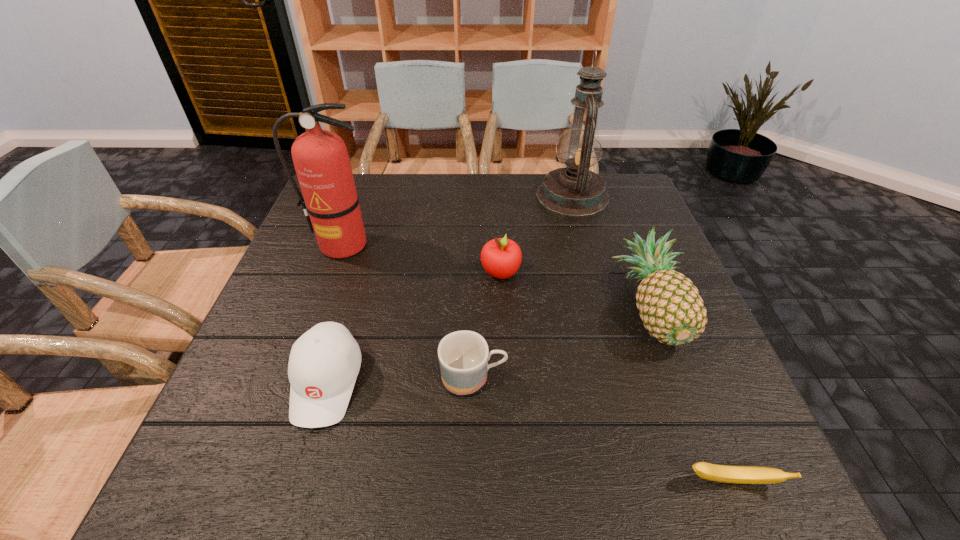
Where is `vacant space positioned 0.240m on the front of the third tallest object`? vacant space positioned 0.240m on the front of the third tallest object is located at coordinates (719, 483).

Image resolution: width=960 pixels, height=540 pixels. Identify the location of vacant position located on the right of the apple. (598, 273).

The image size is (960, 540). I want to click on free spot located 0.090m on the front-facing side of the baseball cap, so pos(297,483).

The height and width of the screenshot is (540, 960). I want to click on free space located on the side with the handle of the mug, so click(x=599, y=378).

The width and height of the screenshot is (960, 540). I want to click on object that is positioned at the far edge, so click(575, 191).

Image resolution: width=960 pixels, height=540 pixels. What are the coordinates of `object present at the near edge` in the screenshot? It's located at (721, 473).

At what (x,y) coordinates should I click in order to perform the action: click on fire extinguisher at the left edge. Please return your answer as a coordinate pair (x, y). Image resolution: width=960 pixels, height=540 pixels. Looking at the image, I should click on (330, 201).

Where is `baseball cap that is at the left edge`? The height and width of the screenshot is (540, 960). baseball cap that is at the left edge is located at coordinates (324, 362).

The height and width of the screenshot is (540, 960). I want to click on oil lamp located in the right edge section of the desktop, so click(575, 191).

Locate an element on the screen. pineapple positioned at the right edge is located at coordinates click(670, 306).